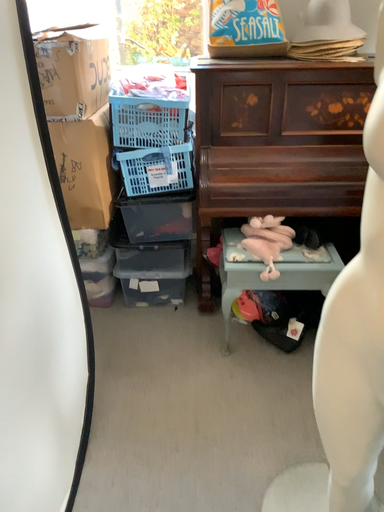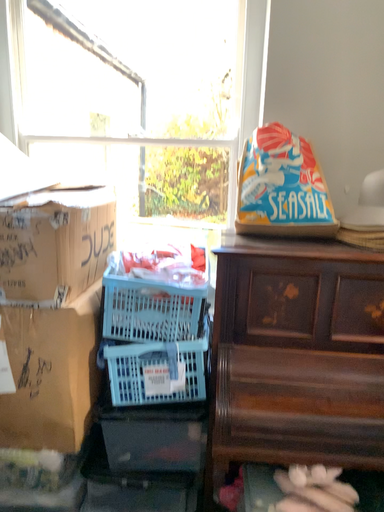
Question: How did the camera likely rotate when shooting the video?

Choices:
 (A) rotated downward
 (B) rotated upward

Answer: (B)